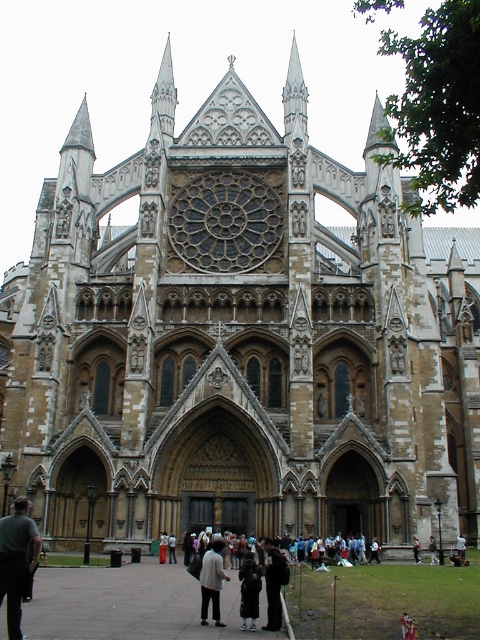
Does dark gray fabric jacket at lower left have a larger size compared to light beige fabric coat at center?

No.

Measure the distance between dark gray fabric jacket at lower left and camera.

dark gray fabric jacket at lower left and camera are 110.89 feet apart.

Identify the location of dark gray fabric jacket at lower left. The width and height of the screenshot is (480, 640). (15, 561).

Is point (212, 588) farther from camera compared to point (261, 586)?

No, (212, 588) is in front of (261, 586).

Does point (211, 548) come behind point (243, 580)?

Yes, point (211, 548) is farther from viewer.

Locate an element on the screen. The image size is (480, 640). light beige fabric coat at center is located at coordinates (212, 580).

Between dark brown leather coat at center and white cotton jacket at center, which one has less height?

white cotton jacket at center

Which is more to the right, dark brown leather coat at center or white cotton jacket at center?

From the viewer's perspective, white cotton jacket at center appears more on the right side.

The height and width of the screenshot is (640, 480). Describe the element at coordinates (275, 582) in the screenshot. I see `dark brown leather coat at center` at that location.

This screenshot has width=480, height=640. Identify the location of dark brown leather coat at center. (275, 582).